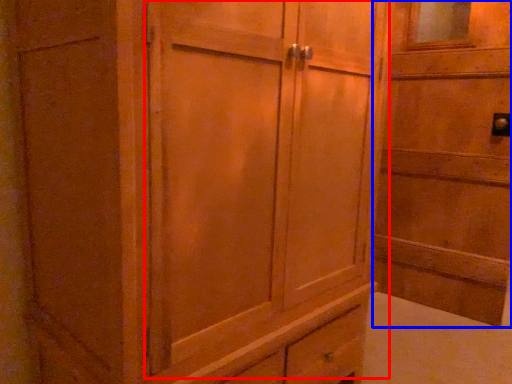
Question: Which of the following is the farthest to the observer, barn door (highlighted by a red box) or elevator (highlighted by a blue box)?

Choices:
 (A) barn door
 (B) elevator

Answer: (B)